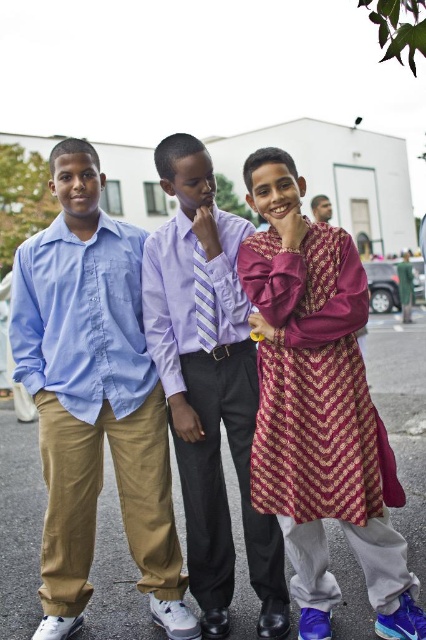
Can you confirm if light blue cotton shirt at center is positioned above gold textured fabric at center?

No.

At what (x,y) coordinates should I click in order to perform the action: click on light blue cotton shirt at center. Please return your answer as a coordinate pair (x, y). This screenshot has width=426, height=640. Looking at the image, I should click on (94, 397).

Between light blue cotton shirt at center and purple striped tie at center, which one is positioned lower?

light blue cotton shirt at center is below.

Can you confirm if light blue cotton shirt at center is taller than purple striped tie at center?

Yes.

Image resolution: width=426 pixels, height=640 pixels. What do you see at coordinates (94, 397) in the screenshot? I see `light blue cotton shirt at center` at bounding box center [94, 397].

Where is `light blue cotton shirt at center`? The image size is (426, 640). light blue cotton shirt at center is located at coordinates (94, 397).

Looking at this image, does light blue cotton shirt at center appear on the right side of maroon patterned kurta at center?

In fact, light blue cotton shirt at center is to the left of maroon patterned kurta at center.

Is point (94, 227) positioned behind point (313, 244)?

Yes.

Describe the element at coordinates (94, 397) in the screenshot. I see `light blue cotton shirt at center` at that location.

Image resolution: width=426 pixels, height=640 pixels. Find the location of `light blue cotton shirt at center`. light blue cotton shirt at center is located at coordinates (94, 397).